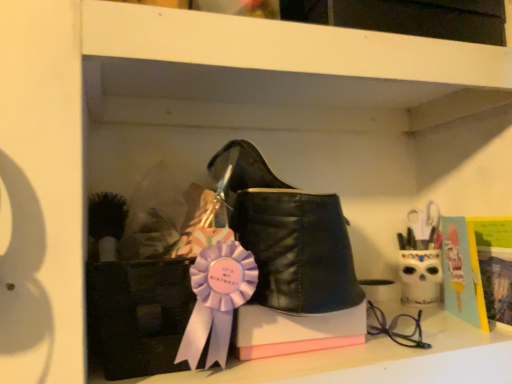
Find the location of a particular element. This screenshot has width=512, height=384. empty space that is to the right of matte black glasses at lower right is located at coordinates (455, 329).